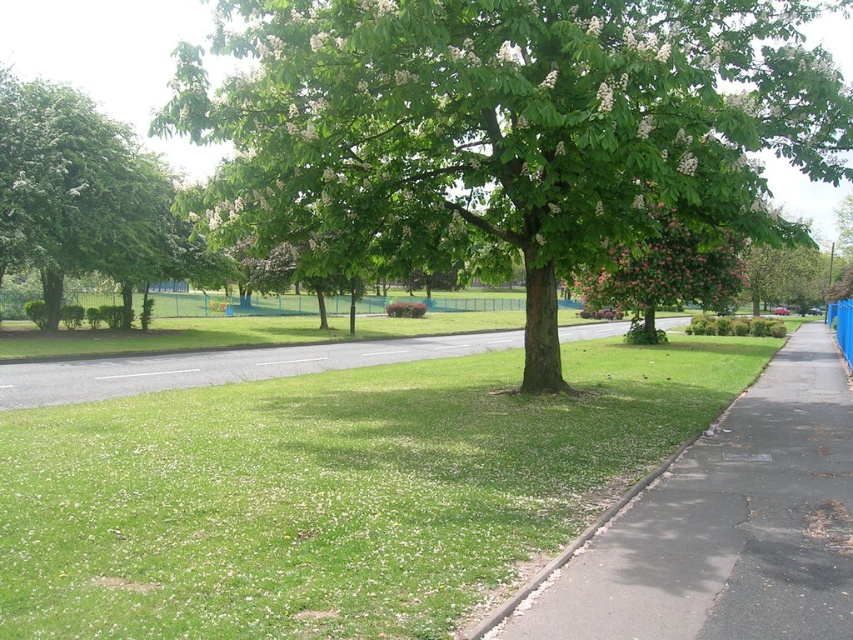
You are a gardener planning to plant a new tree in the park. You want to ensure that the new tree will not block the sidewalk. Based on the scene, is the green leafy tree at center currently blocking the gray asphalt sidewalk at lower right?

The green leafy tree at center is positioned over the gray asphalt sidewalk at lower right, so it is currently blocking the sidewalk.

You are a gardener who needs to water the pink flowered tree at center. You have a hose that can reach 3 meters. The gray asphalt sidewalk at lower right is in the way. Can you water the tree without stepping on the sidewalk?

The gray asphalt sidewalk at lower right is located below the pink flowered tree at center, so you can water the tree from above without stepping on the sidewalk as long as the hose can reach 3 meters.